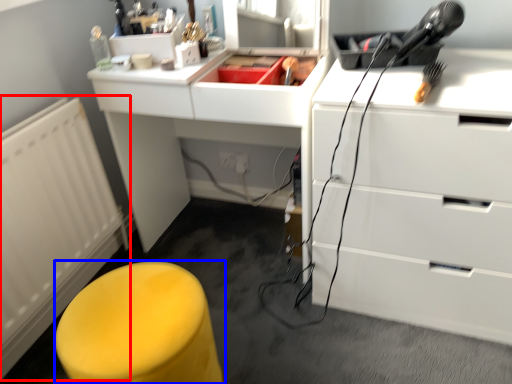
Question: Which of the following is the farthest to the observer, radiator (highlighted by a red box) or furniture (highlighted by a blue box)?

Choices:
 (A) radiator
 (B) furniture

Answer: (A)